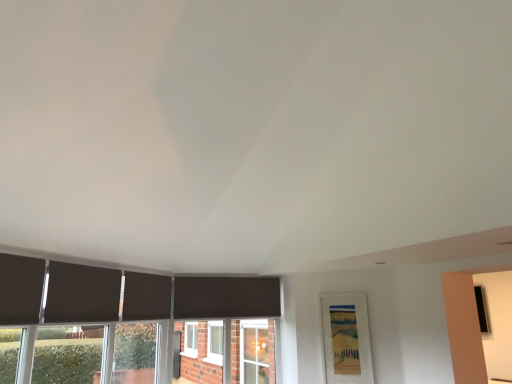
Question: From a real-world perspective, is dark matte curtain at lower left, which is counted as the 2th curtain, starting from the back, positioned above or below dark matte curtain at left, the first curtain viewed from the front?

Choices:
 (A) below
 (B) above

Answer: (B)

Question: In terms of height, does dark matte curtain at lower left, acting as the second curtain starting from the left, look taller or shorter compared to dark matte curtain at left, which is counted as the third curtain, starting from the back?

Choices:
 (A) short
 (B) tall

Answer: (A)

Question: Estimate the real-world distances between objects in this image. Which object is farther from the dark matte curtain at left, the first curtain viewed from the front?

Choices:
 (A) dark matte curtain at lower left, which is counted as the 2th curtain, starting from the back
 (B) matte black curtain at center, the third curtain viewed from the front

Answer: (B)

Question: Estimate the real-world distances between objects in this image. Which object is farther from the dark matte curtain at left, which is counted as the third curtain, starting from the back?

Choices:
 (A) dark matte curtain at lower left, the second curtain positioned from the front
 (B) matte black curtain at center, the third curtain viewed from the front

Answer: (B)